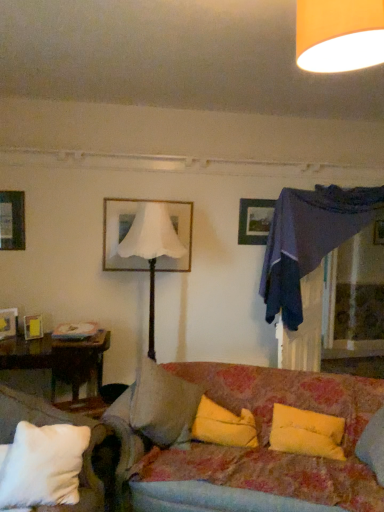
Question: From a real-world perspective, is white matte picture frame at upper center, marked as the first picture frame in a right-to-left arrangement, positioned above or below white soft pillow at lower left, positioned as the first pillow in left-to-right order?

Choices:
 (A) below
 (B) above

Answer: (B)

Question: Is white matte picture frame at upper center, the fourth picture frame in the left-to-right sequence, taller or shorter than white soft pillow at lower left, the 3th pillow from the right?

Choices:
 (A) tall
 (B) short

Answer: (A)

Question: Based on their relative distances, which object is farther from the white matte picture frame at upper center, marked as the first picture frame in a right-to-left arrangement?

Choices:
 (A) metallic silver picture frame at upper left, the third picture frame when ordered from right to left
 (B) floral fabric couch at center
 (C) transparent glass door at upper right
 (D) orange fabric lampshade at upper center, which is counted as the 1th lamp, starting from the right
 (E) white soft pillow at lower left, the 3th pillow from the right

Answer: (D)

Question: Which of these objects is positioned farthest from the floral fabric couch at center?

Choices:
 (A) white fabric lampshade at center, which appears as the first lamp when ordered from the bottom
 (B) yellow fabric pillow at center, which is the 1th pillow from right to left
 (C) brown wooden table at lower left
 (D) white matte picture frame at upper center, the fourth picture frame in the left-to-right sequence
 (E) yellow fabric pillow at center, which ranks as the second pillow in right-to-left order

Answer: (D)